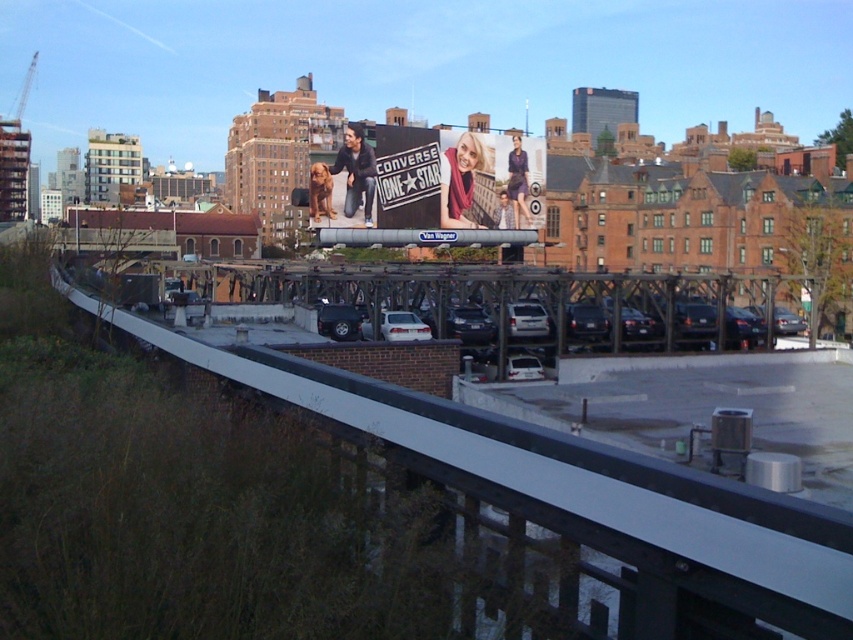
Does point (723, 300) lie behind point (459, 314)?

Yes, it is behind point (459, 314).

Can you confirm if metallic gray overpass at center is thinner than white matte car at center?

In fact, metallic gray overpass at center might be wider than white matte car at center.

Who is more distant from viewer, (x=437, y=284) or (x=480, y=330)?

Point (x=480, y=330)

Where is `metallic gray overpass at center`? metallic gray overpass at center is located at coordinates (517, 298).

Measure the distance between metallic gray overpass at center and matte white billboard at center.

metallic gray overpass at center is 22.68 meters from matte white billboard at center.

Is metallic gray overpass at center above matte white billboard at center?

No, metallic gray overpass at center is not above matte white billboard at center.

Where is `metallic gray overpass at center`? metallic gray overpass at center is located at coordinates (517, 298).

What are the coordinates of `metallic gray overpass at center` in the screenshot? It's located at (517, 298).

Measure the distance between point (490, 326) and camera.

The distance of point (490, 326) from camera is 173.16 feet.

Does white matte car at center lie in front of white glossy sedan at center?

That is True.

Locate an element on the screen. white matte car at center is located at coordinates (695, 326).